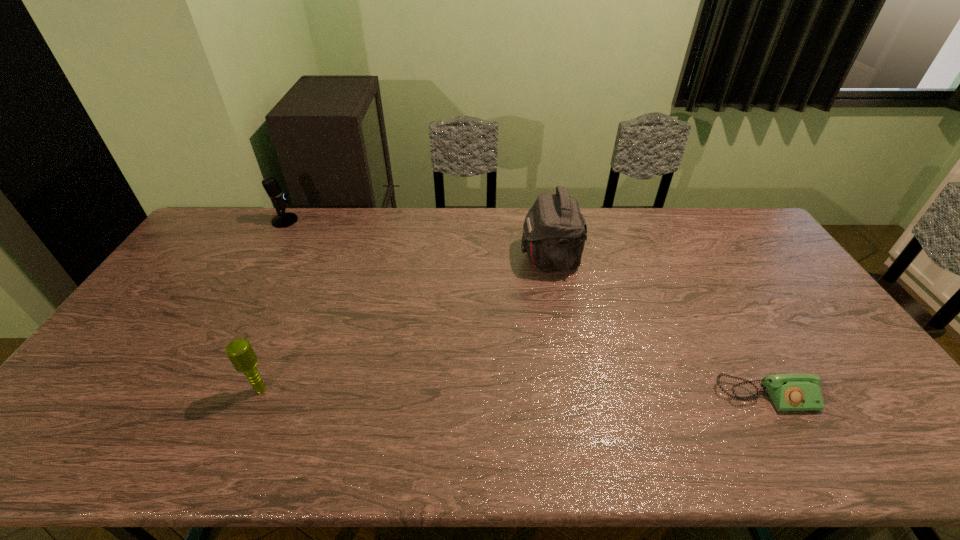
Find the location of a particular element. This screenshot has width=960, height=540. free space located 0.090m on the open flap of the second farthest object is located at coordinates (493, 258).

Locate an element on the screen. The width and height of the screenshot is (960, 540). vacant space situated on the right of the farthest object is located at coordinates (337, 221).

Where is `vacant space situated 0.160m on the left of the third object from right to left`? This screenshot has height=540, width=960. vacant space situated 0.160m on the left of the third object from right to left is located at coordinates (187, 389).

At what (x,y) coordinates should I click in order to perform the action: click on blank area located on the dial of the rightmost object. Please return your answer as a coordinate pair (x, y). This screenshot has height=540, width=960. Looking at the image, I should click on point(788,436).

The width and height of the screenshot is (960, 540). What are the coordinates of `shoulder bag that is at the far edge` in the screenshot? It's located at (554, 231).

Locate an element on the screen. This screenshot has width=960, height=540. microphone that is at the far edge is located at coordinates (283, 219).

At what (x,y) coordinates should I click in order to perform the action: click on free region at the far edge. Please return your answer as a coordinate pair (x, y). Looking at the image, I should click on (284, 239).

In the image, there is a desktop. Find the location of `vacant space at the left edge`. vacant space at the left edge is located at coordinates (84, 397).

In the image, there is a desktop. Where is `vacant space at the far left corner`? Image resolution: width=960 pixels, height=540 pixels. vacant space at the far left corner is located at coordinates (223, 212).

This screenshot has width=960, height=540. I want to click on free space between the right microphone and the telephone, so click(514, 393).